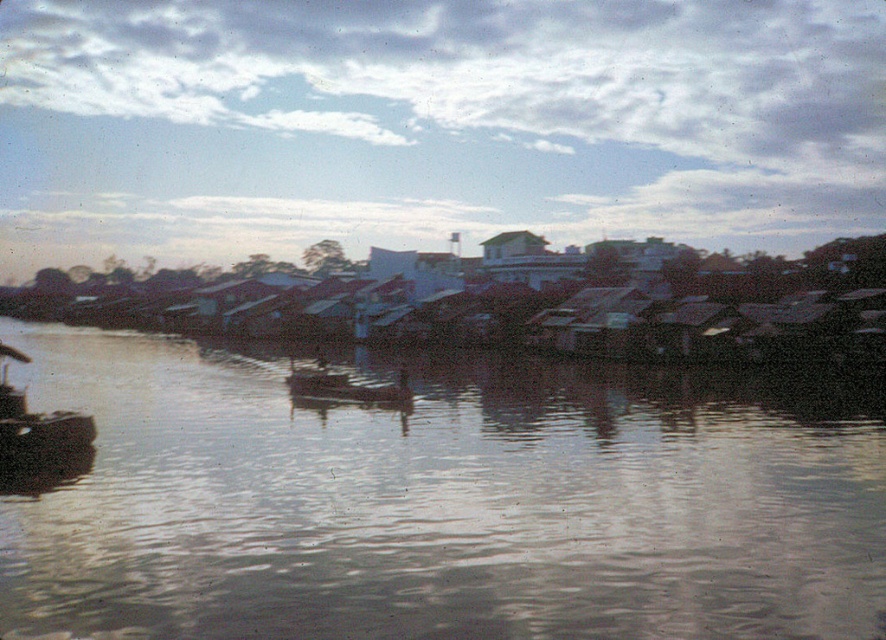
Does brown matte water at center lie in front of wooden boat at lower left?

Yes, brown matte water at center is closer to the viewer.

Describe the element at coordinates (441, 500) in the screenshot. This screenshot has height=640, width=886. I see `brown matte water at center` at that location.

Who is more distant from viewer, (263, 417) or (21, 428)?

The point (263, 417) is behind.

Find the location of `brown matte water at center`. brown matte water at center is located at coordinates (441, 500).

Is point (836, 596) more distant than point (362, 388)?

No.

Is point (91, 342) closer to camera compared to point (393, 400)?

No, (91, 342) is further to viewer.

Find the location of a particular element. The width and height of the screenshot is (886, 640). brown matte water at center is located at coordinates (x=441, y=500).

Is wooden boat at lower left to the right of wooden boat at center from the viewer's perspective?

No, wooden boat at lower left is not to the right of wooden boat at center.

Does point (9, 348) come in front of point (391, 388)?

No, (9, 348) is behind (391, 388).

What do you see at coordinates (39, 432) in the screenshot? I see `wooden boat at lower left` at bounding box center [39, 432].

Locate an element on the screen. The height and width of the screenshot is (640, 886). wooden boat at lower left is located at coordinates (39, 432).